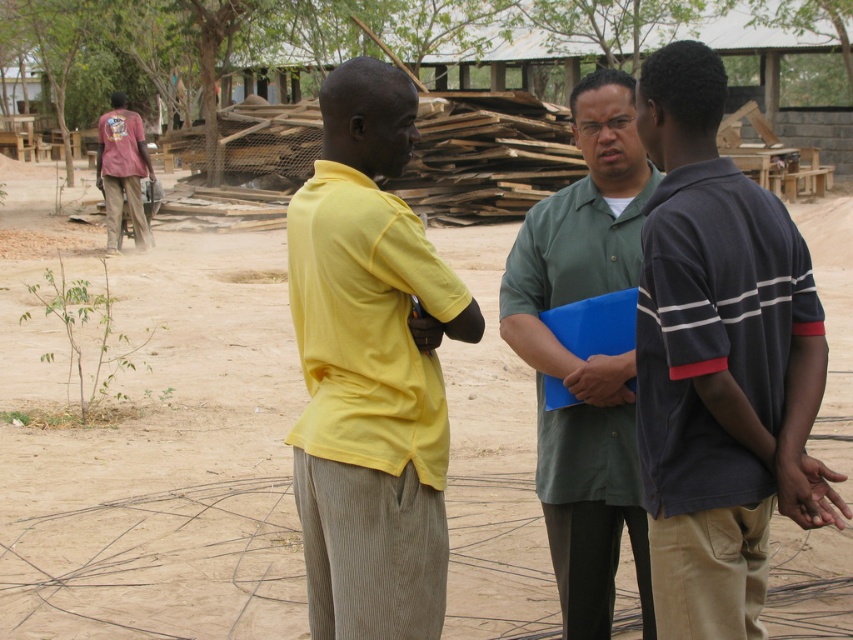
You are a safety inspector at the construction site and need to ensure all workers are visible. You see two workers in the foreground wearing a yellow cotton shirt at center and a green matte shirt at center. Which worker is more visible from a distance?

The yellow cotton shirt at center is more visible because it is positioned over the green matte shirt at center, making it stand out more in the sandy and uneven environment.